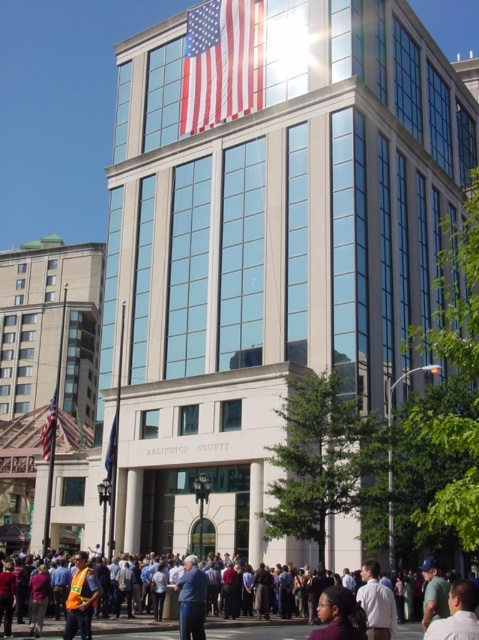
Can you confirm if dark brown hair at lower center is shorter than white shirt at center?

In fact, dark brown hair at lower center may be taller than white shirt at center.

The height and width of the screenshot is (640, 479). What do you see at coordinates (340, 616) in the screenshot? I see `dark brown hair at lower center` at bounding box center [340, 616].

The image size is (479, 640). Identify the location of dark brown hair at lower center. (340, 616).

Does light brown hair at lower right appear on the right side of blue fabric shirt at center?

Correct, you'll find light brown hair at lower right to the right of blue fabric shirt at center.

Who is more distant from viewer, (452,588) or (190,596)?

Point (190,596)

Where is `light brown hair at lower right`? light brown hair at lower right is located at coordinates (457, 612).

Which of these two, red fabric flag at left or blue fabric flag at center, stands shorter?

With less height is blue fabric flag at center.

How far apart are red fabric flag at left and blue fabric flag at center?

red fabric flag at left and blue fabric flag at center are 37.91 feet apart.

The image size is (479, 640). What do you see at coordinates (49, 428) in the screenshot?
I see `red fabric flag at left` at bounding box center [49, 428].

The image size is (479, 640). What are the coordinates of `red fabric flag at left` in the screenshot? It's located at (49, 428).